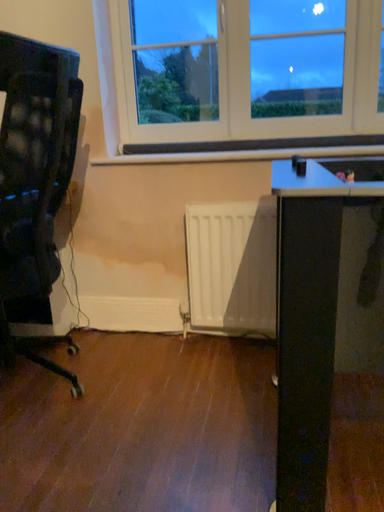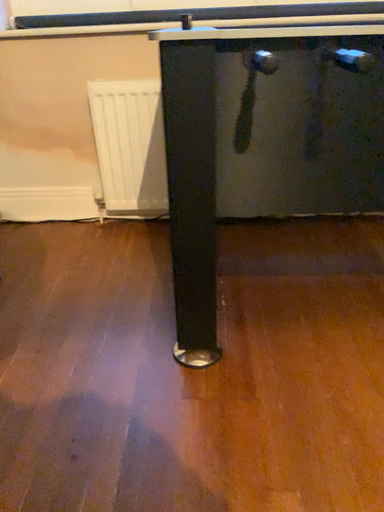
Question: Which way did the camera rotate in the video?

Choices:
 (A) rotated left
 (B) rotated right

Answer: (B)